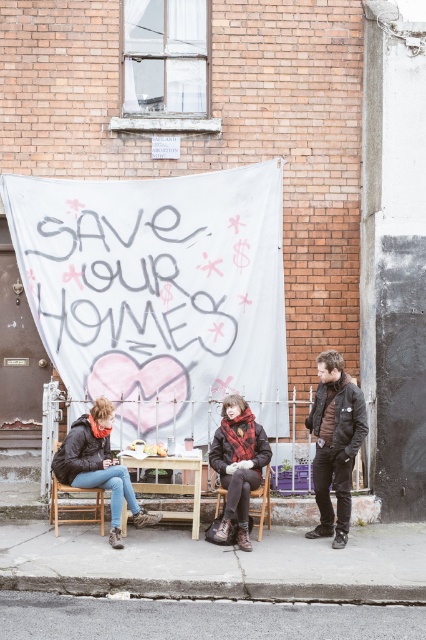
You are a photographer trying to capture a closeup of the flannel plaid scarf at center and the wooden chair at lower left in the scene. Which object should you zoom in on to ensure both are in focus without moving the camera?

The flannel plaid scarf at center is larger in size compared to the wooden chair at lower left, so you should zoom in on the flannel plaid scarf at center to ensure both are in focus without moving the camera.